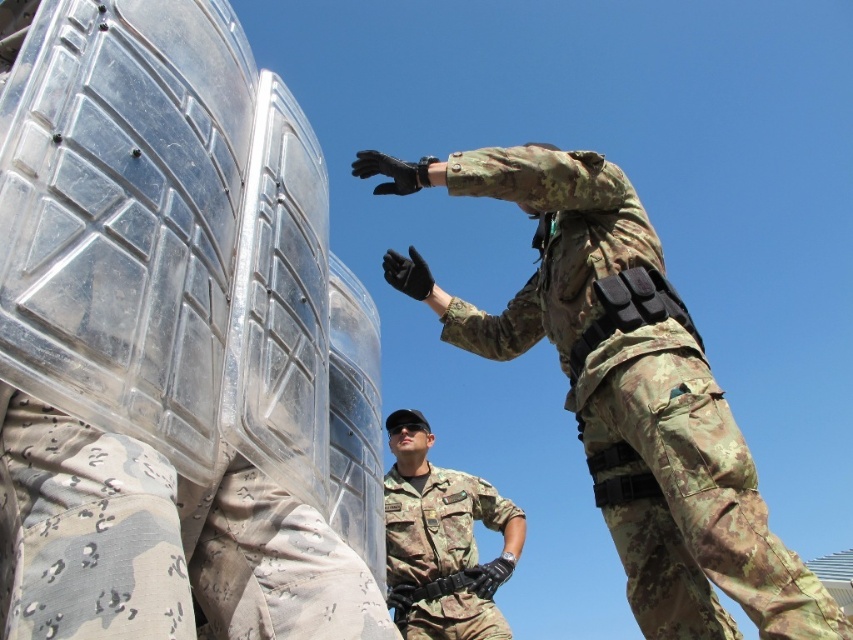
You are a photographer trying to capture a clear image of both the camouflage fabric uniform at center and the camouflage uniform at center. Since you can only focus on one object at a time, which one should you choose to ensure the other is still in the background?

You should focus on the camouflage fabric uniform at center because it is closer to the viewer, and the camouflage uniform at center will naturally appear in the background.